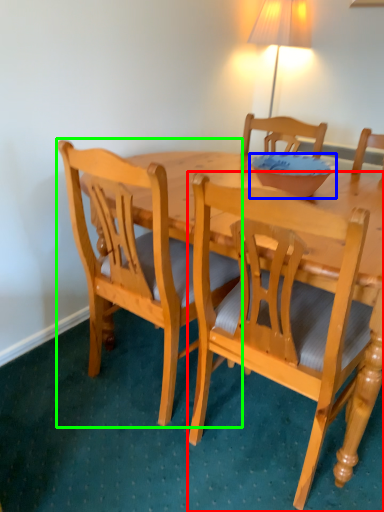
Question: Which is farther away from chair (highlighted by a red box)? bowl (highlighted by a blue box) or chair (highlighted by a green box)?

Choices:
 (A) bowl
 (B) chair

Answer: (A)